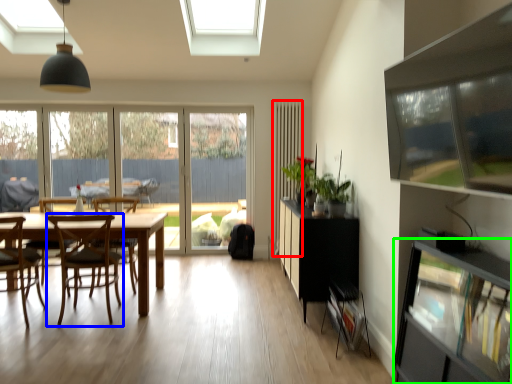
Question: Estimate the real-world distances between objects in this image. Which object is farther from curtain (highlighted by a red box), chair (highlighted by a blue box) or shelf (highlighted by a green box)?

Choices:
 (A) chair
 (B) shelf

Answer: (B)